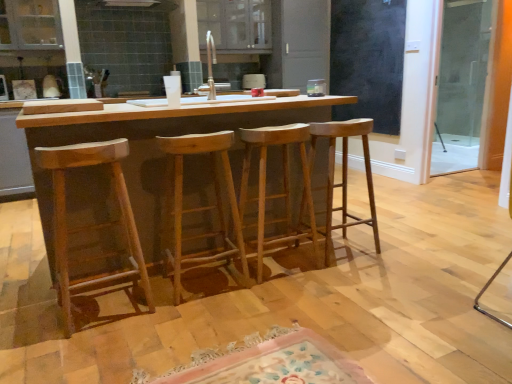
Identify the location of vacant region in front of natural wood stool at center, the 1th stool viewed from the right. This screenshot has width=512, height=384. (358, 276).